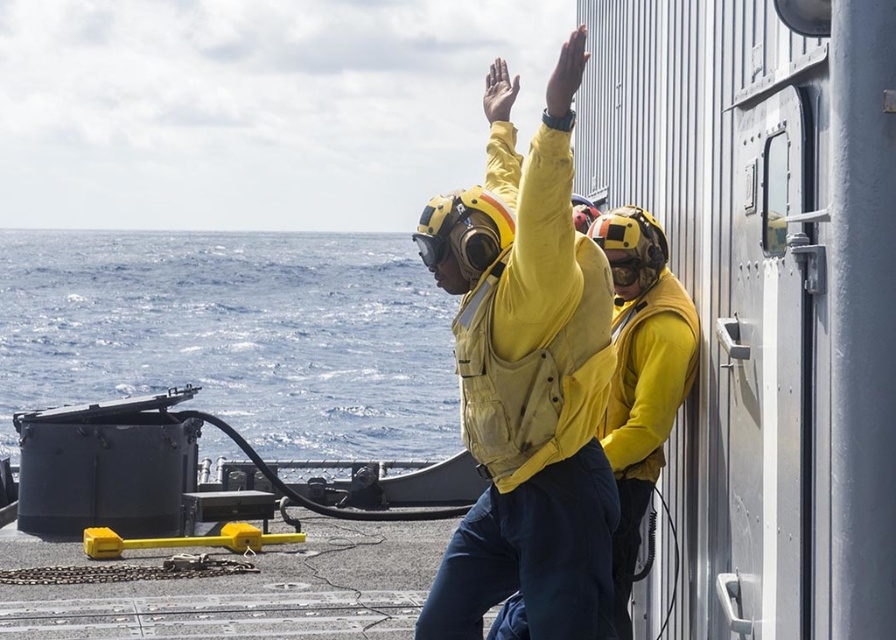
Who is more forward, (263,397) or (470,353)?

Point (470,353) is more forward.

Which is below, blue water at left or yellow matte life vest at center?

Positioned lower is yellow matte life vest at center.

You are a GUI agent. You are given a task and a screenshot of the screen. Output one action in this format:
    pyautogui.click(x=<x>, y=<y>)
    Task: Click on the blue water at left
    This screenshot has height=640, width=896.
    Given the screenshot: What is the action you would take?
    pyautogui.click(x=235, y=333)